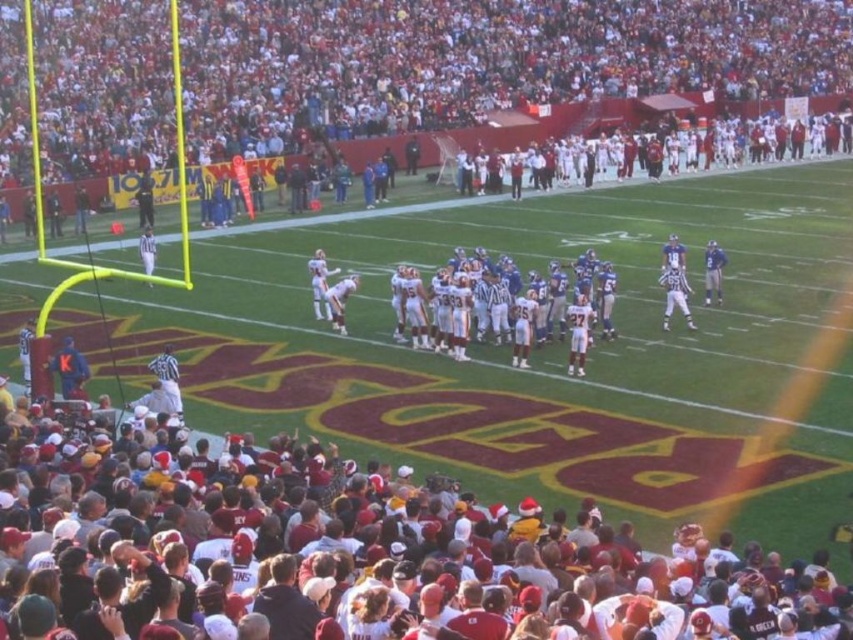
Who is shorter, maroon fabric crowd at lower center or red fabric crowd at upper center?

maroon fabric crowd at lower center

Consider the image. Is maroon fabric crowd at lower center to the right of red fabric crowd at upper center from the viewer's perspective?

No, maroon fabric crowd at lower center is not to the right of red fabric crowd at upper center.

Identify the location of maroon fabric crowd at lower center. The width and height of the screenshot is (853, 640). (357, 545).